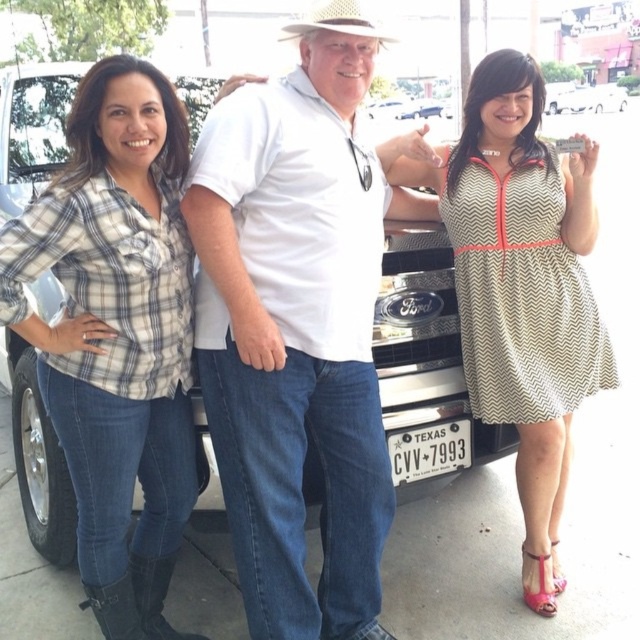
Is white cotton shirt at center thinner than strawhat at center?

No.

Between white cotton shirt at center and strawhat at center, which one is positioned higher?

strawhat at center is higher up.

At what (x,y) coordinates should I click in order to perform the action: click on white cotton shirt at center. Please return your answer as a coordinate pair (x, y). Looking at the image, I should click on (294, 336).

Does point (76, 481) lie behind point (346, 10)?

Yes, it is behind point (346, 10).

The width and height of the screenshot is (640, 640). Find the location of `plaid cotton shirt at left`. plaid cotton shirt at left is located at coordinates (116, 333).

Locate an element on the screen. Image resolution: width=640 pixels, height=640 pixels. plaid cotton shirt at left is located at coordinates (116, 333).

Is point (323, 96) closer to camera compared to point (448, 470)?

Yes, it is.

Does white cotton shirt at center have a lesser height compared to black metal license plate at lower center?

No.

This screenshot has height=640, width=640. In order to click on white cotton shirt at center in this screenshot , I will do `click(294, 336)`.